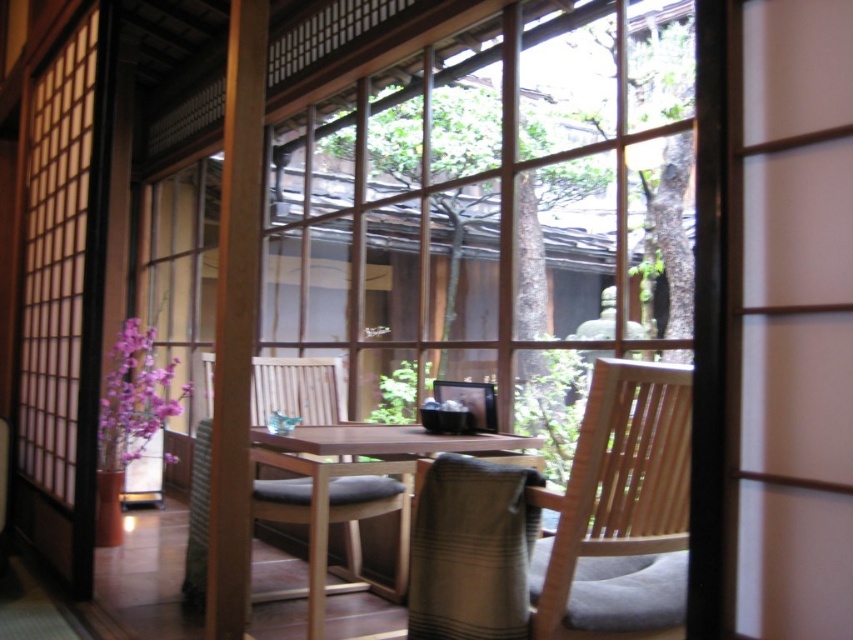
You are standing at the entrance of the sliding door and want to sit down on the wooden chair at center. Which direction should you walk to reach it?

The wooden chair at center is located at point 0.809 on the x and 0.392 on the y, so you should walk towards the center of the room to reach it.

You are planning to place a large potted plant in the center of the room. Which chair, the natural wood chair at center or the wooden chair at center, would you need to move to make space?

The natural wood chair at center is smaller than the wooden chair at center, so you would need to move the wooden chair at center to make space for the large potted plant.